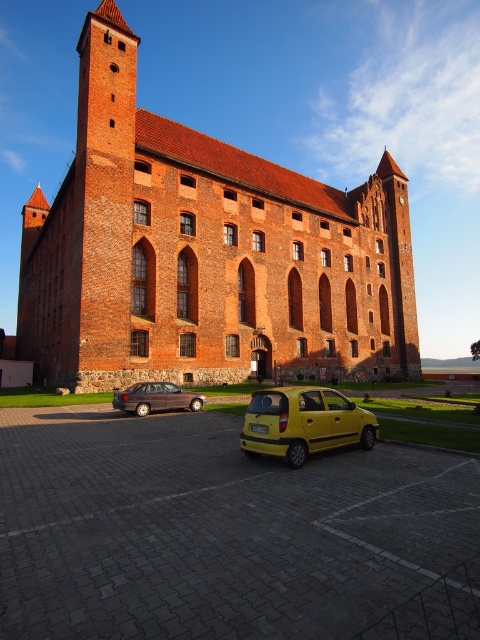
Question: Which object is positioned closest to the yellow plastic car at lower center?

Choices:
 (A) yellow matte taxi at lower center
 (B) brick building at center

Answer: (A)

Question: Where is brick building at center located in relation to yellow plastic car at lower center in the image?

Choices:
 (A) below
 (B) above

Answer: (B)

Question: Which object is positioned closest to the yellow plastic car at lower center?

Choices:
 (A) yellow matte taxi at lower center
 (B) brick building at center
 (C) matte black sedan at lower left

Answer: (A)

Question: Is yellow plastic car at lower center below matte black sedan at lower left?

Choices:
 (A) no
 (B) yes

Answer: (B)

Question: Is yellow plastic car at lower center below matte black sedan at lower left?

Choices:
 (A) no
 (B) yes

Answer: (B)

Question: Which of the following is the closest to the observer?

Choices:
 (A) matte black sedan at lower left
 (B) yellow plastic car at lower center
 (C) brick building at center

Answer: (B)